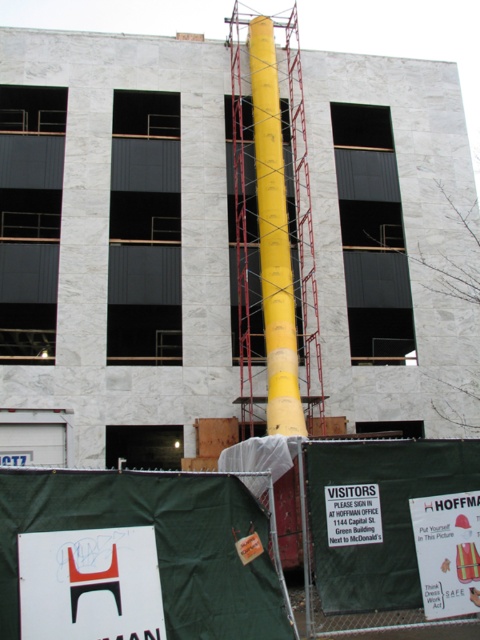
Question: Which of the following is the closest to the observer?

Choices:
 (A) yellow plastic pipe at center
 (B) matte white sign at lower left
 (C) white paper sign at lower right
 (D) yellow matte pole at center

Answer: (A)

Question: Is matte white sign at lower left above white paper sign at lower right?

Choices:
 (A) yes
 (B) no

Answer: (A)

Question: Which point is farther from the camera taking this photo?

Choices:
 (A) (103, 538)
 (B) (416, 516)
 (C) (350, 252)
 (D) (288, 250)

Answer: (C)

Question: Which point is closer to the camera taking this photo?

Choices:
 (A) (160, 600)
 (B) (427, 545)

Answer: (A)

Question: From the image, what is the correct spatial relationship of matte white sign at lower left in relation to yellow matte pole at center?

Choices:
 (A) above
 (B) below

Answer: (B)

Question: In this image, where is yellow plastic pipe at center located relative to white paper sign at lower right?

Choices:
 (A) above
 (B) below

Answer: (A)